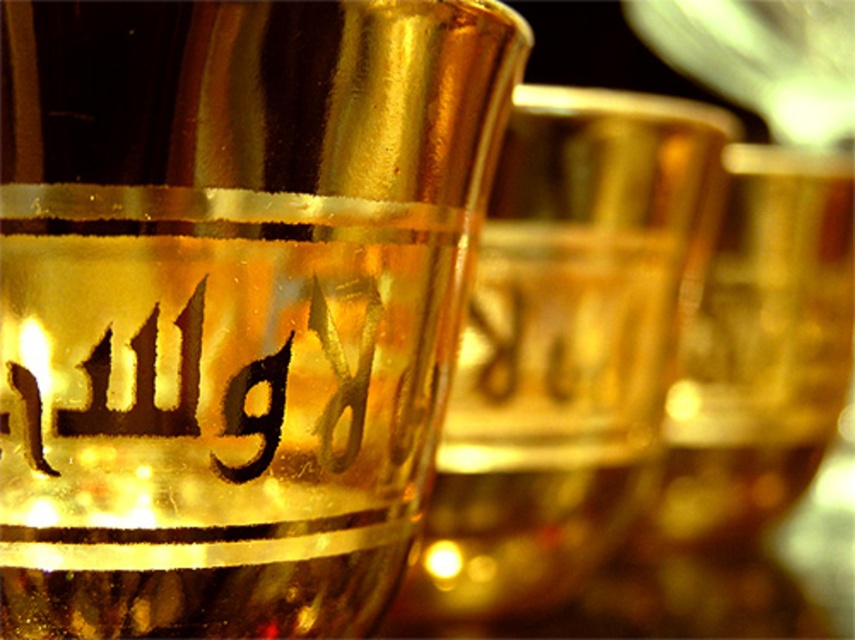
Question: Can you confirm if shiny gold glass at center is wider than gold metallic beer glass at center?

Choices:
 (A) no
 (B) yes

Answer: (A)

Question: Does shiny gold glass at center lie behind gold metallic beer glass at center?

Choices:
 (A) yes
 (B) no

Answer: (B)

Question: Can you confirm if shiny gold glass at center is positioned to the left of gold metallic beer glass at center?

Choices:
 (A) yes
 (B) no

Answer: (A)

Question: Which object is farther from the camera taking this photo?

Choices:
 (A) gold metallic beer glass at center
 (B) shiny gold glass at center

Answer: (A)

Question: Which point is closer to the camera taking this photo?

Choices:
 (A) (570, 481)
 (B) (342, 445)

Answer: (B)